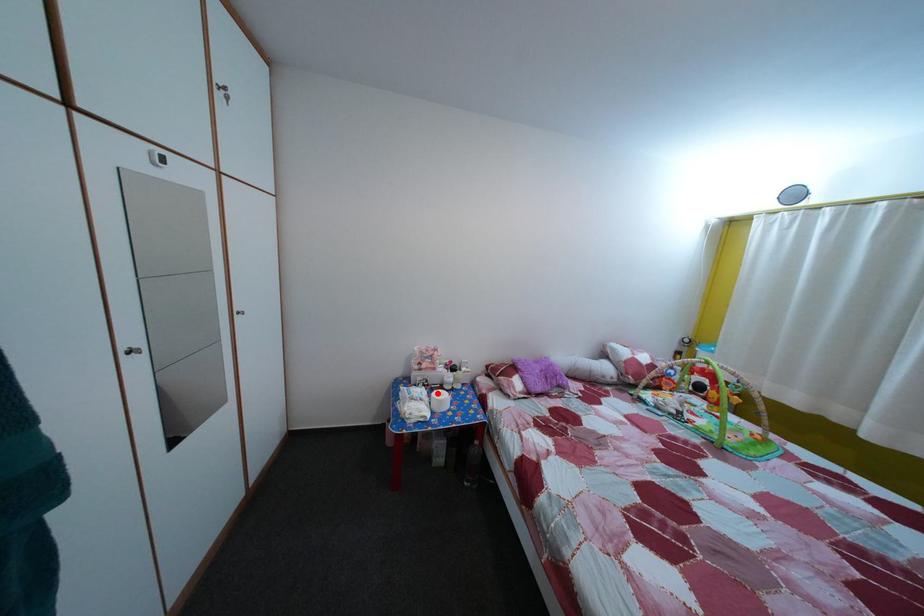
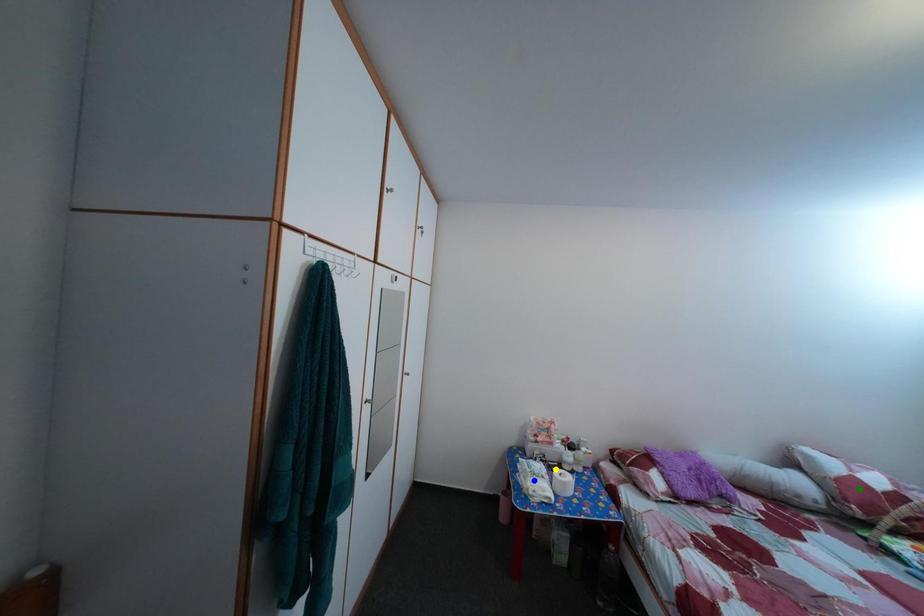
Question: I am providing you with two images of the same scene from different viewpoints. A red point is marked on the first image. You are given multiple points on the second image. Which mark in image 2 goes with the point in image 1?

Choices:
 (A) green point
 (B) blue point
 (C) yellow point

Answer: (C)